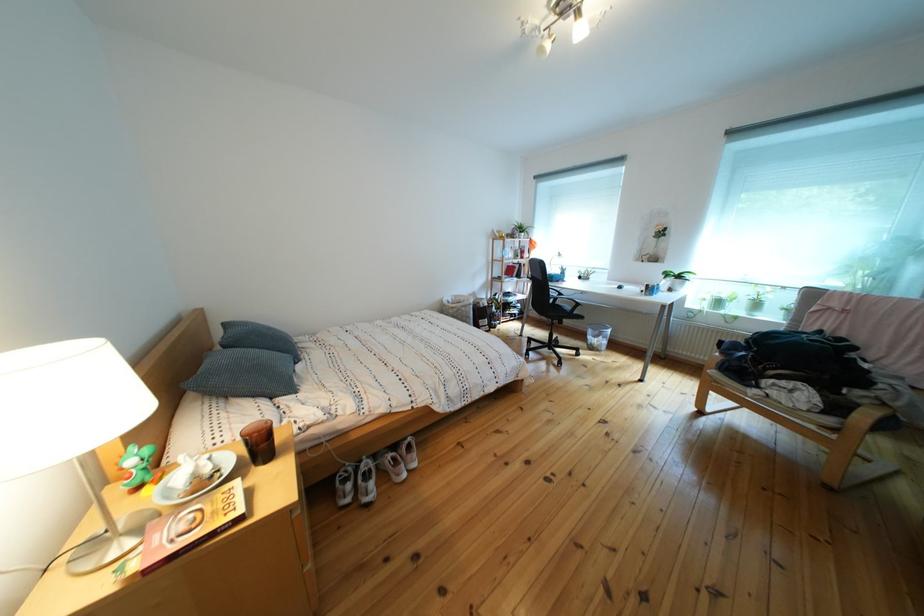
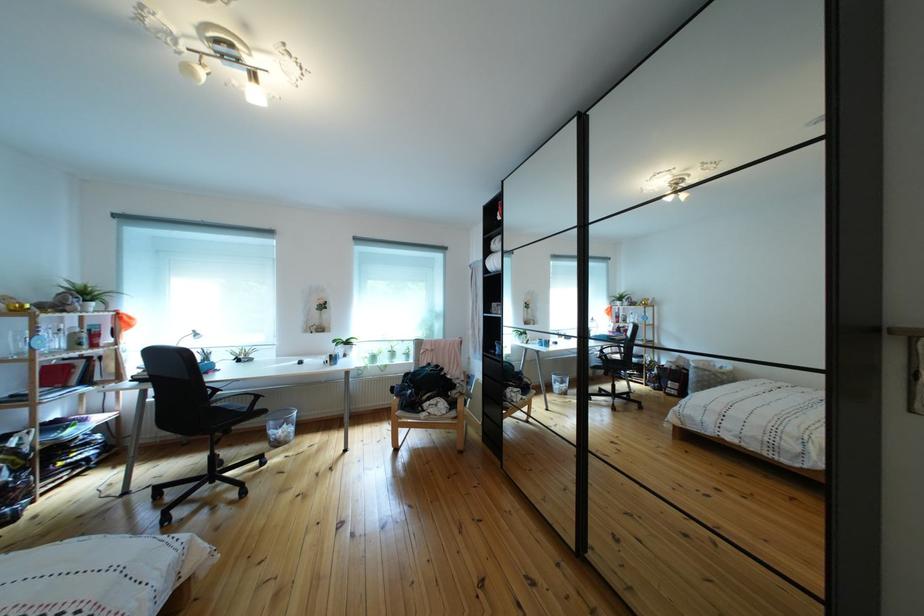
In the second image, find the point that corresponds to (x=572, y=300) in the first image.

(227, 395)